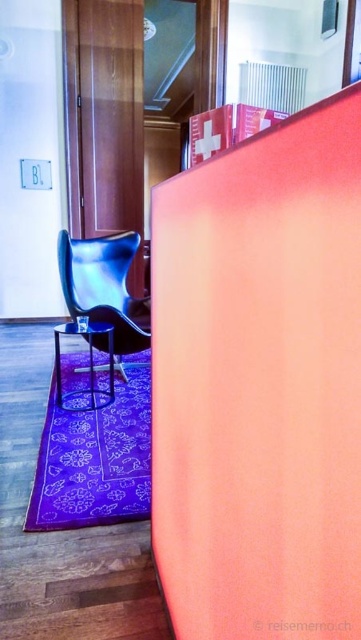
You are a guest in this space and need to sit down. Which object, the shiny blue leather armchair at lower left or the metallic stool at lower left, is a better option if you prefer a taller seat?

The shiny blue leather armchair at lower left is taller than the metallic stool at lower left, so it is a better option if you prefer a taller seat.

You are a guest in this space and want to sit comfortably. Which object, the shiny blue leather armchair at lower left or the metallic stool at lower left, offers more seating space?

The shiny blue leather armchair at lower left offers more seating space because its width is larger than the metallic stool at lower left.

You are a guest in this space and want to sit down. You see the shiny blue leather armchair at lower left and the metallic stool at lower left. Which one is positioned to the right side?

The shiny blue leather armchair at lower left is positioned to the right of the metallic stool at lower left.